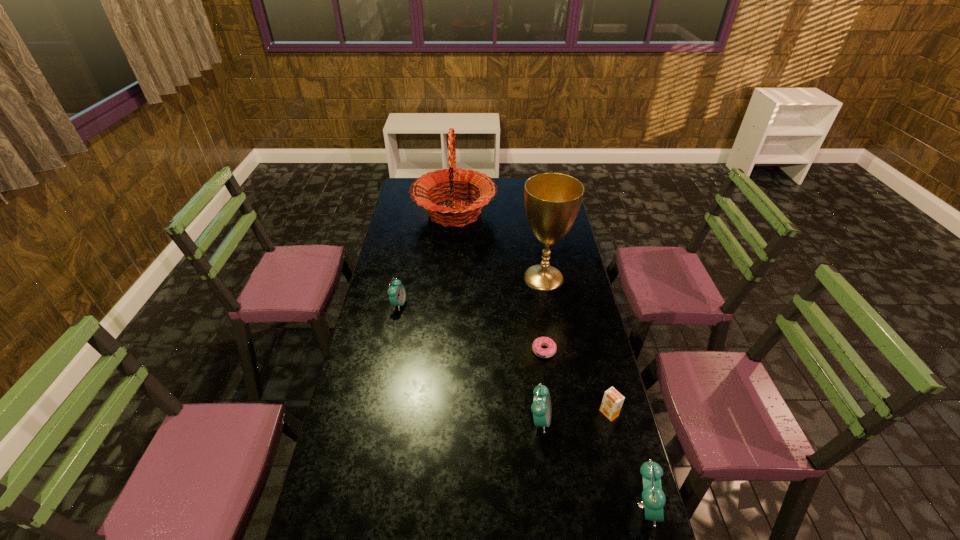
Locate an element on the screen. The height and width of the screenshot is (540, 960). location for an additional alarm_clock to make spacing equal is located at coordinates (461, 355).